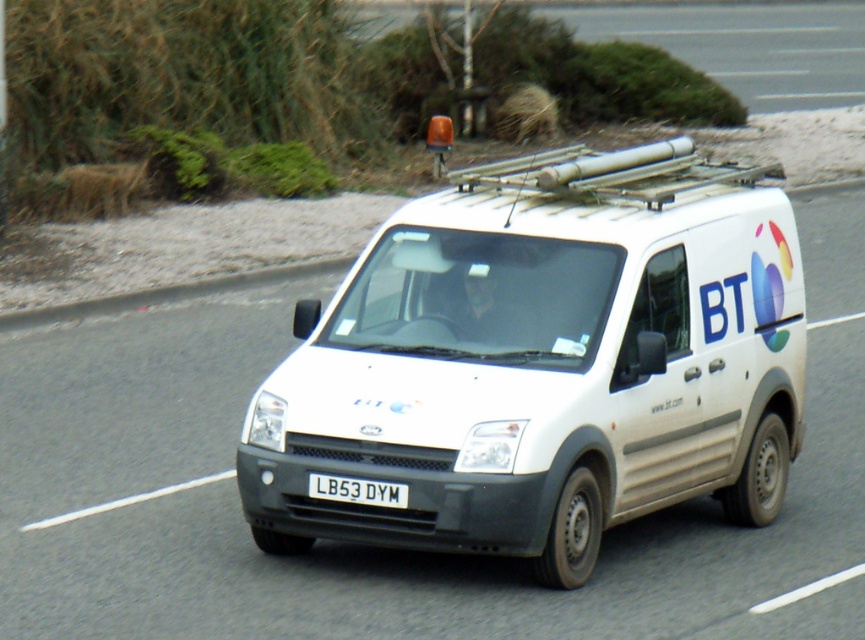
What do you see at coordinates (543, 360) in the screenshot? The width and height of the screenshot is (865, 640). I see `white matte van at center` at bounding box center [543, 360].

Is white matte van at center positioned behind white plastic license plate at center?

That is False.

Is point (495, 179) positioned behind point (338, 480)?

Yes.

Find the location of a particular element. This screenshot has height=640, width=865. white matte van at center is located at coordinates [543, 360].